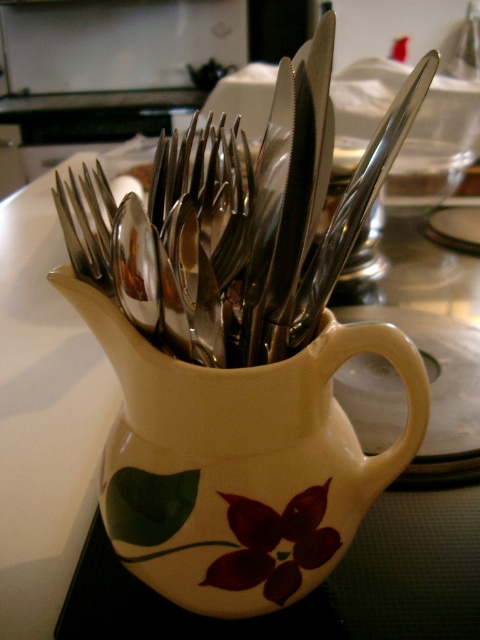
Who is shorter, white ceramic jug at center or satin silver knife at upper center?

satin silver knife at upper center is shorter.

Can you confirm if white ceramic jug at center is positioned to the left of satin silver knife at upper center?

Indeed, white ceramic jug at center is positioned on the left side of satin silver knife at upper center.

This screenshot has height=640, width=480. What are the coordinates of `white ceramic jug at center` in the screenshot? It's located at (240, 461).

What do you see at coordinates (357, 202) in the screenshot? I see `satin silver knife at upper center` at bounding box center [357, 202].

Between point (391, 122) and point (84, 273), which one is positioned in front?

Point (391, 122) is in front.

I want to click on satin silver knife at upper center, so click(357, 202).

From the picture: Is white ceramic jug at center to the right of satin silver fork at center from the viewer's perspective?

Yes, white ceramic jug at center is to the right of satin silver fork at center.

Measure the distance between white ceramic jug at center and camera.

white ceramic jug at center is 12.78 inches from camera.

What are the coordinates of `white ceramic jug at center` in the screenshot? It's located at (240, 461).